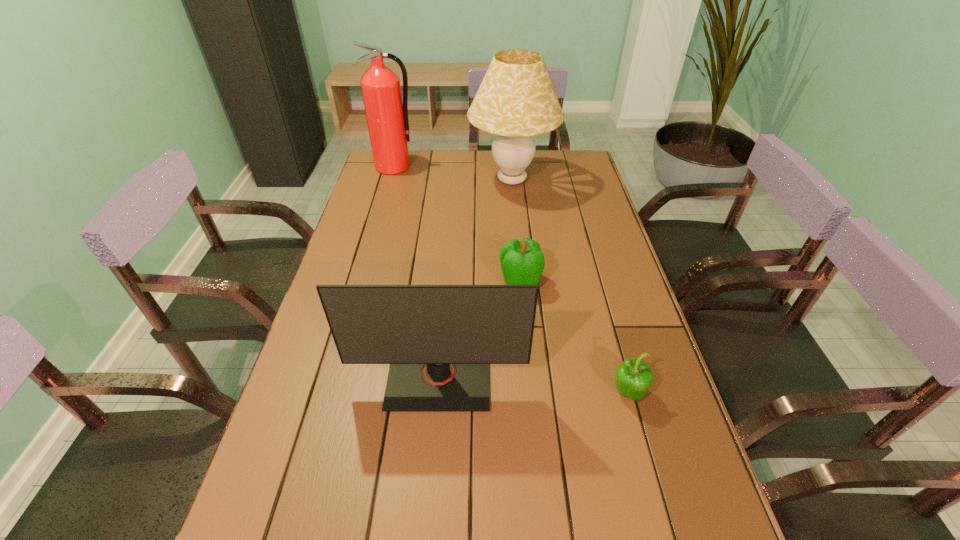
Locate an element on the screen. vacant space located on the back of the third nearest object is located at coordinates (515, 222).

This screenshot has width=960, height=540. What are the coordinates of `vacant space located 0.180m on the left of the shorter bell pepper` in the screenshot? It's located at [530, 393].

Identify the location of fire extinguisher at the far edge. (387, 115).

This screenshot has width=960, height=540. Find the location of `lampshade that is at the far edge`. lampshade that is at the far edge is located at coordinates pos(516,100).

The width and height of the screenshot is (960, 540). I want to click on fire extinguisher at the left edge, so click(x=387, y=115).

The width and height of the screenshot is (960, 540). In order to click on monitor located in the left edge section of the desktop in this screenshot , I will do (439, 340).

This screenshot has width=960, height=540. I want to click on lampshade located at the right edge, so click(516, 100).

The image size is (960, 540). Find the location of `bell pepper located at the right edge`. bell pepper located at the right edge is located at coordinates (633, 377).

The height and width of the screenshot is (540, 960). In order to click on object that is at the far left corner in this screenshot , I will do `click(387, 115)`.

Where is `object that is at the far right corner`? Image resolution: width=960 pixels, height=540 pixels. object that is at the far right corner is located at coordinates (516, 100).